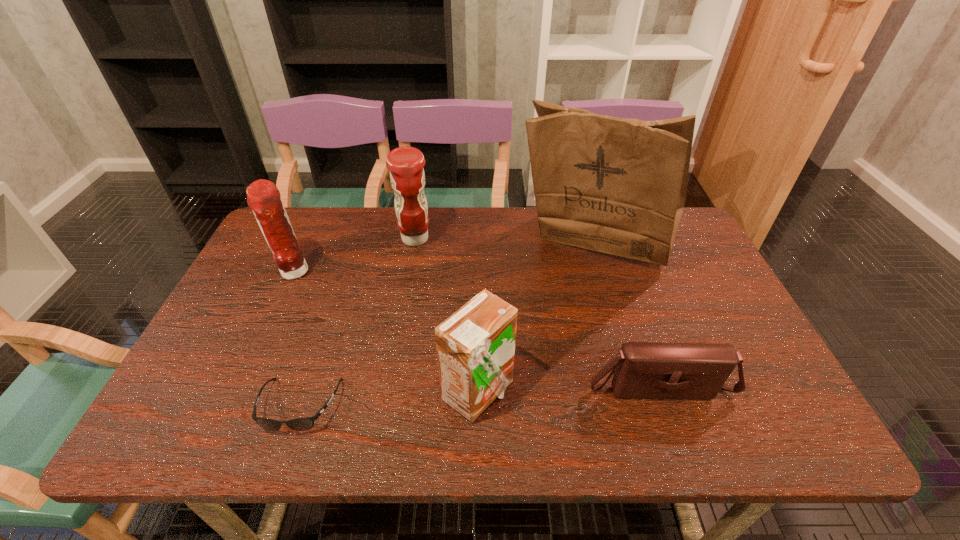
Find the location of a particular element. vacant area situated 0.330m on the left of the grocery bag is located at coordinates (407, 248).

At what (x,y) coordinates should I click in order to perform the action: click on blank space located on the right of the fourth object from right to left. Please return your answer as a coordinate pair (x, y). The width and height of the screenshot is (960, 540). Looking at the image, I should click on (547, 239).

Image resolution: width=960 pixels, height=540 pixels. I want to click on free space located on the back of the left condiment, so click(x=319, y=217).

Locate an element on the screen. The height and width of the screenshot is (540, 960). vacant space located 0.260m on the straw side of the fourth object from left to right is located at coordinates (631, 393).

Locate an element on the screen. The image size is (960, 540). free space located 0.080m on the front flap of the shoulder bag is located at coordinates (678, 441).

You are a GUI agent. You are given a task and a screenshot of the screen. Output one action in this format:
    pyautogui.click(x=<x>, y=<y>)
    Task: Click on the grocery bag situated at the far edge
    This screenshot has width=960, height=540.
    Given the screenshot: What is the action you would take?
    pyautogui.click(x=618, y=186)

Locate an element on the screen. The height and width of the screenshot is (540, 960). condiment at the far edge is located at coordinates (407, 176).

At what (x,y) coordinates should I click in order to perform the action: click on carton situated at the near edge. Please return your answer as a coordinate pair (x, y). Looking at the image, I should click on (475, 346).

The image size is (960, 540). Identify the location of sunglasses that is at the near edge. (300, 424).

Identify the location of object that is at the left edge. Image resolution: width=960 pixels, height=540 pixels. (263, 197).